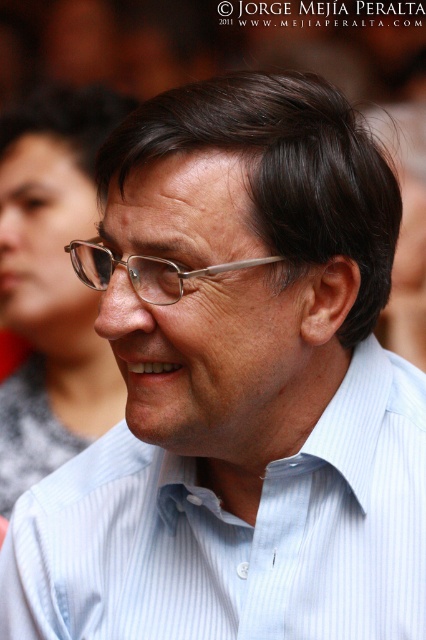
Based on the scene description, where is the light blue striped dress shirt at center located in the image?

The light blue striped dress shirt at center is located at point [235,532].

You are a photographer trying to adjust the focus of your camera to capture the light blue striped dress shirt at center and the metallic silver glasses at center. Which object should you focus on first if you want to ensure both are in focus, given their positions?

The light blue striped dress shirt at center is below metallic silver glasses at center, so you should focus on the metallic silver glasses at center first to ensure both are in focus.